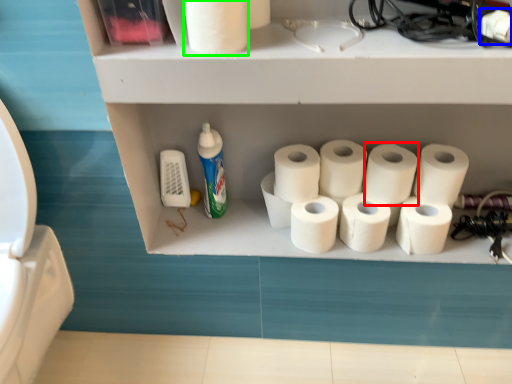
Question: Considering the real-world distances, which object is farthest from toilet paper (highlighted by a red box)? toilet paper (highlighted by a blue box) or toilet paper (highlighted by a green box)?

Choices:
 (A) toilet paper
 (B) toilet paper

Answer: (B)